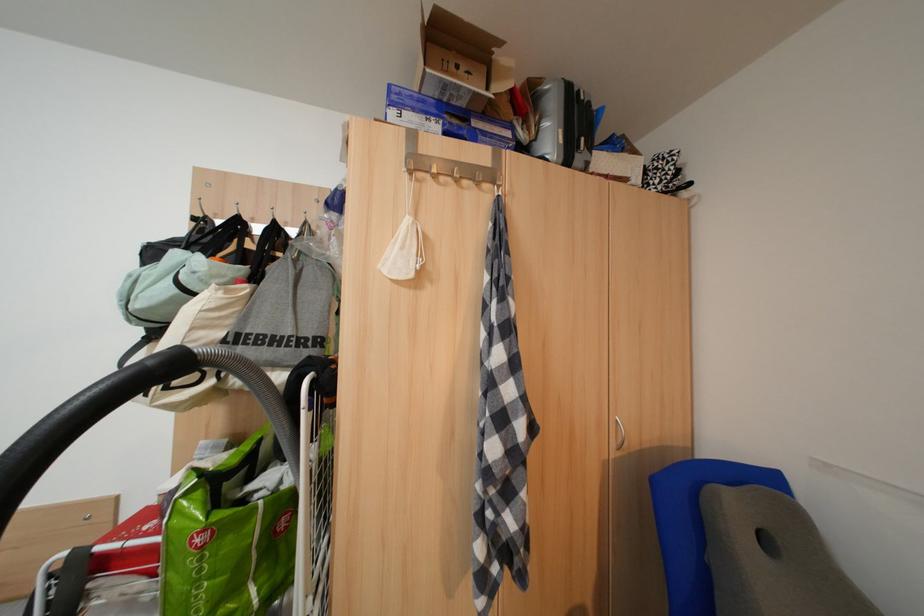
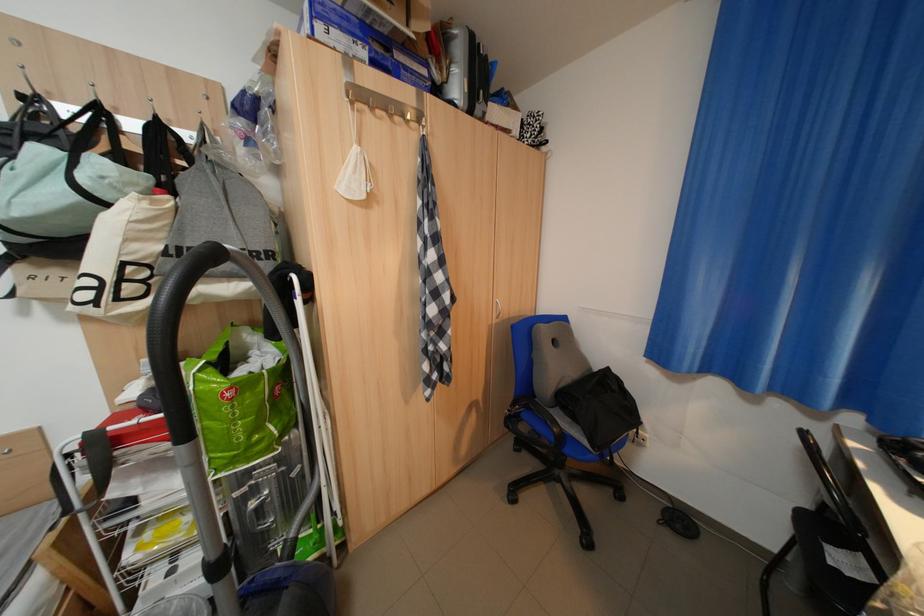
Based on the continuous images, in which direction is the camera rotating?

The rotation direction of the camera is right-down.